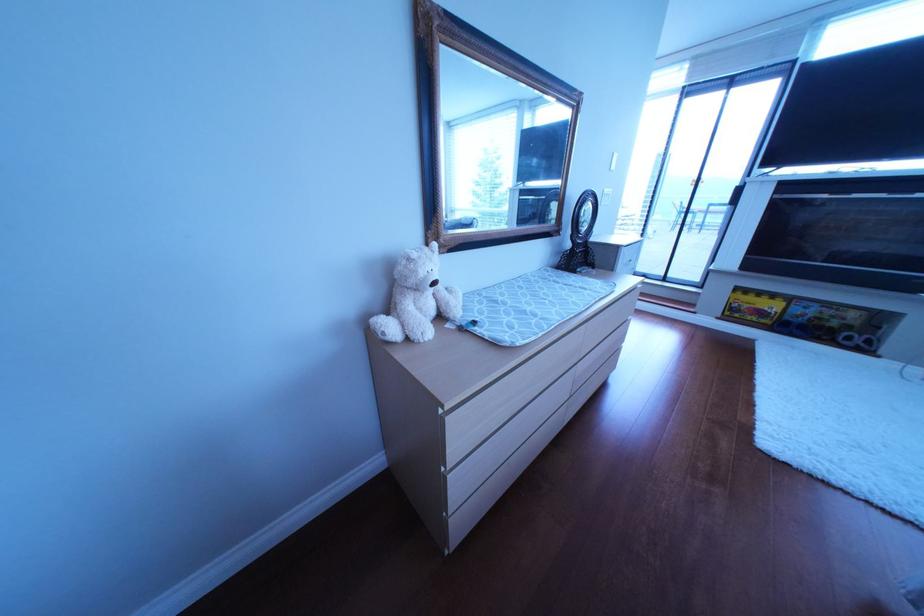
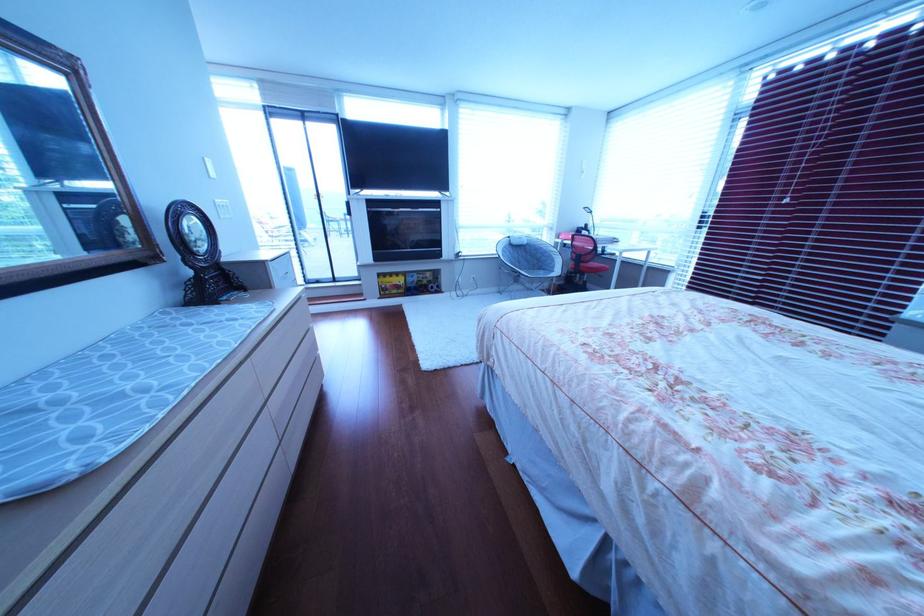
Question: Based on the continuous images, in which direction is the camera rotating? Reply with the corresponding letter.

Choices:
 (A) Left
 (B) Right
 (C) Up
 (D) Down

Answer: (B)